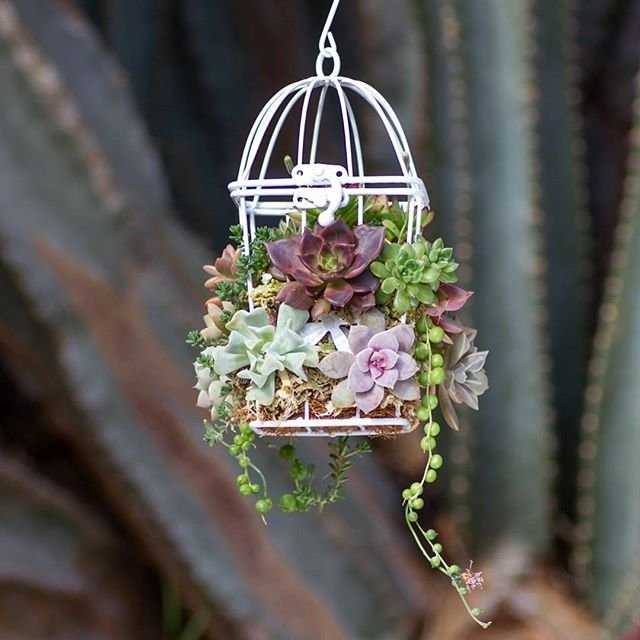
Identify the location of lock. The width and height of the screenshot is (640, 640). [x=310, y=196].